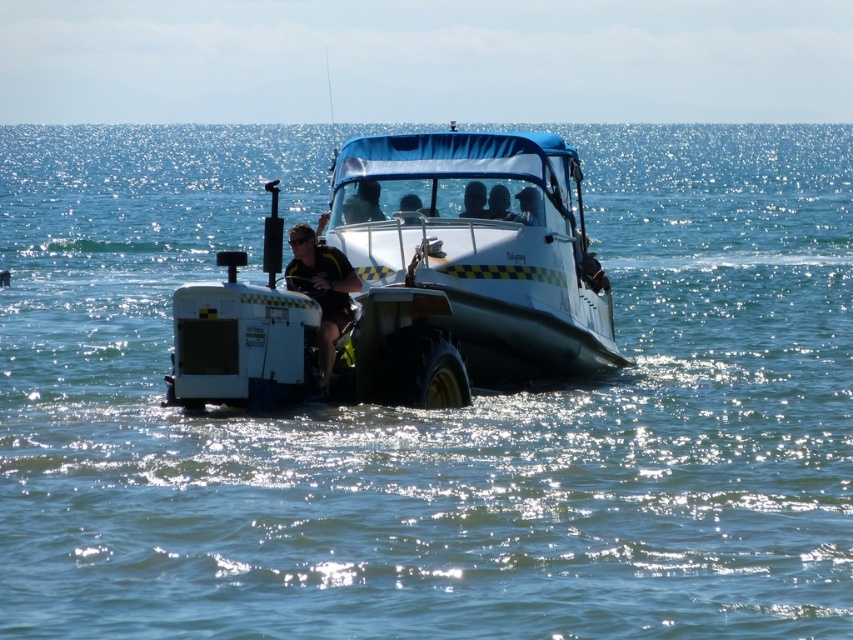
Question: Which point is farther from the camera taking this photo?

Choices:
 (A) (474, 204)
 (B) (538, 209)

Answer: (B)

Question: Does white rubber boat at center lie behind matte black helmet at center?

Choices:
 (A) no
 (B) yes

Answer: (A)

Question: Is matte black helmet at center below smooth skin face at center?

Choices:
 (A) yes
 (B) no

Answer: (A)

Question: Is yellow fabric life vest at center above matte black helmet at center?

Choices:
 (A) yes
 (B) no

Answer: (B)

Question: Which object appears closest to the camera in this image?

Choices:
 (A) matte black helmet at upper center
 (B) white rubber boat at center

Answer: (B)

Question: Which point is farther from the camera taking this photo?

Choices:
 (A) (480, 208)
 (B) (343, 220)
 (C) (498, 198)

Answer: (B)